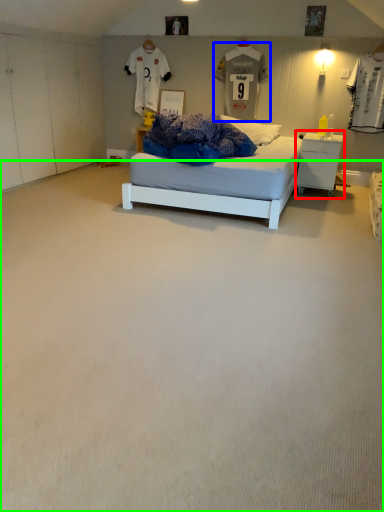
Question: Estimate the real-world distances between objects in this image. Which object is farther from nightstand (highlighted by a red box), t shirt (highlighted by a blue box) or plain (highlighted by a green box)?

Choices:
 (A) t shirt
 (B) plain

Answer: (B)